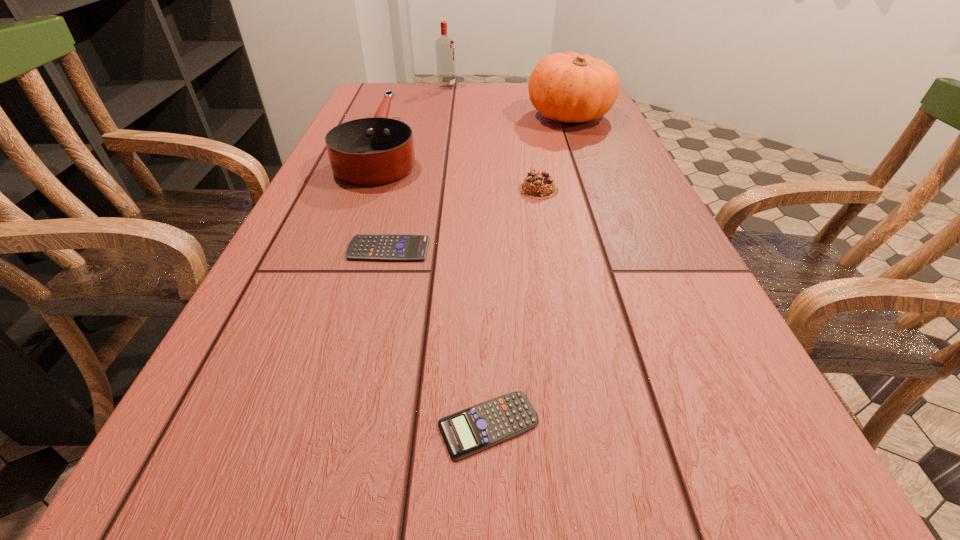
Where is `free point located on the left of the second tallest object`? free point located on the left of the second tallest object is located at coordinates (475, 116).

Identify the location of vacant space situated 0.150m on the handle side of the third tallest object. This screenshot has height=540, width=960. (400, 97).

You are a GUI agent. You are given a task and a screenshot of the screen. Output one action in this format:
    pyautogui.click(x=<x>, y=<y>)
    Task: Click on the blank space located on the handle side of the third tallest object
    This screenshot has height=540, width=960.
    Given the screenshot: What is the action you would take?
    pyautogui.click(x=402, y=92)

Where is `vacant region located on the handle side of the third tallest object`? This screenshot has height=540, width=960. vacant region located on the handle side of the third tallest object is located at coordinates click(x=398, y=103).

You are a GUI agent. You are given a task and a screenshot of the screen. Output one action in this format:
    pyautogui.click(x=<x>, y=<y>)
    Task: Click on the vacant space located on the front of the chocolate cake
    Image resolution: width=960 pixels, height=540 pixels.
    Given the screenshot: What is the action you would take?
    pyautogui.click(x=567, y=340)

The width and height of the screenshot is (960, 540). Identify the location of vacant space located 0.140m on the right of the farther calculator. (503, 249).

The width and height of the screenshot is (960, 540). What are the coordinates of `free space located 0.220m on the back of the nearer calculator` in the screenshot? It's located at (486, 282).

Identify the location of vodka located in the far edge section of the desktop. This screenshot has height=540, width=960. tap(444, 46).

This screenshot has width=960, height=540. What are the coordinates of `pumpkin that is at the far edge` in the screenshot? It's located at (568, 87).

Image resolution: width=960 pixels, height=540 pixels. In order to click on pan at the left edge in this screenshot , I will do `click(371, 151)`.